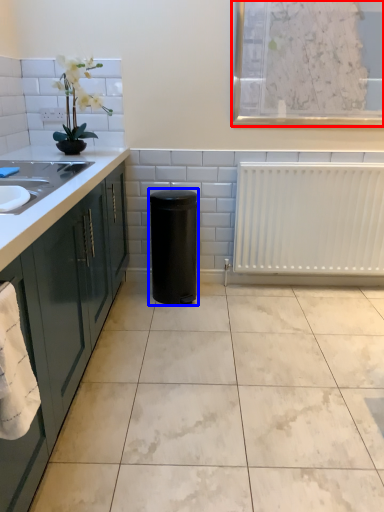
Question: Which of the following is the farthest to the observer, window screen (highlighted by a red box) or appliance (highlighted by a blue box)?

Choices:
 (A) window screen
 (B) appliance

Answer: (B)